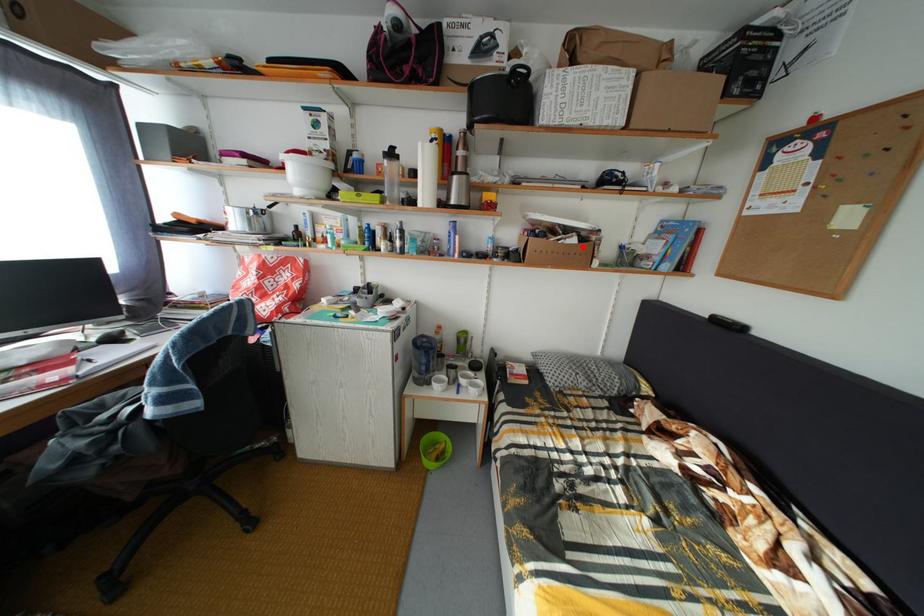
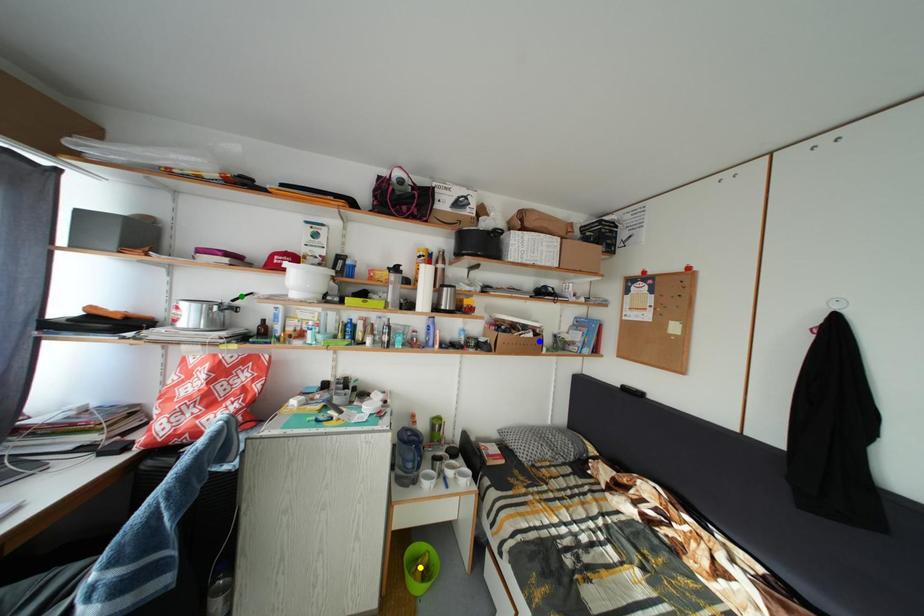
Question: I am providing you with two images of the same scene from different viewpoints. A red point is marked on the first image. You are given multiple points on the second image. In image 2, which mark is for the same physical point as the one in image 1?

Choices:
 (A) yellow point
 (B) green point
 (C) blue point

Answer: (C)